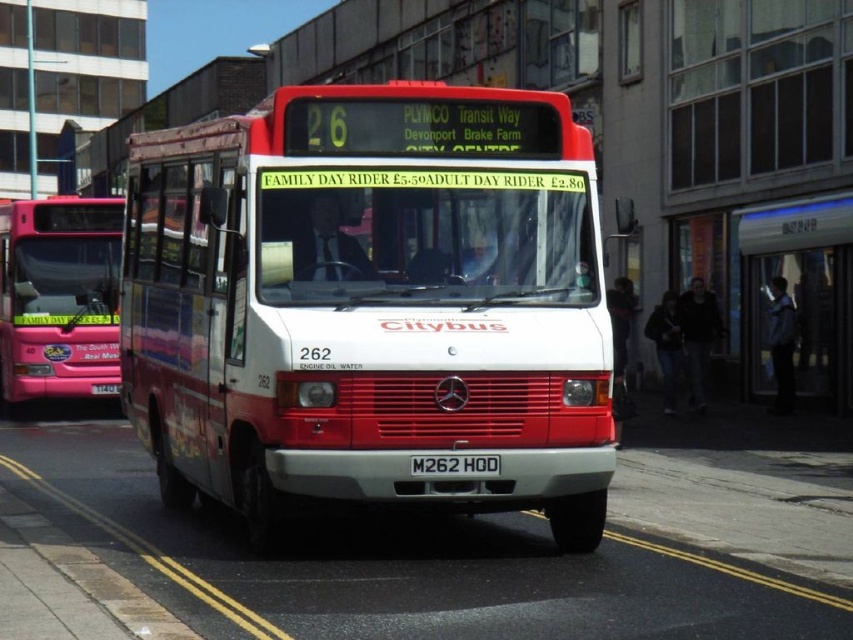
Question: Is matte pink bus at left thinner than black plastic license plate at center?

Choices:
 (A) no
 (B) yes

Answer: (A)

Question: Which of the following is the closest to the observer?

Choices:
 (A) black plastic license plate at center
 (B) matte pink bus at left

Answer: (A)

Question: Which object is the farthest from the white matte bus at center?

Choices:
 (A) black plastic license plate at center
 (B) transparent glass bus stop at center
 (C) matte pink bus at left

Answer: (B)

Question: Can you confirm if white matte bus at center is positioned to the left of transparent glass bus stop at center?

Choices:
 (A) no
 (B) yes

Answer: (B)

Question: Based on their relative distances, which object is farther from the transparent glass bus stop at center?

Choices:
 (A) black plastic license plate at center
 (B) white matte bus at center

Answer: (B)

Question: Does white matte bus at center come in front of transparent glass bus stop at center?

Choices:
 (A) no
 (B) yes

Answer: (B)